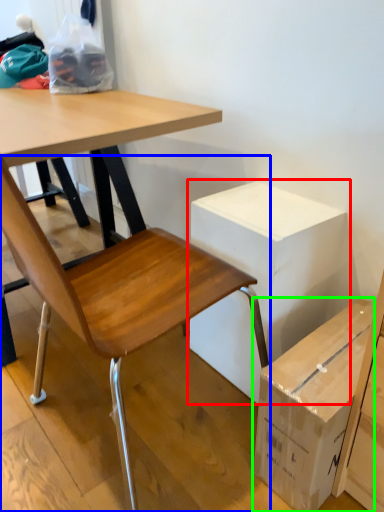
Question: Which is farther away from cardboard box (highlighted by a red box)? chair (highlighted by a blue box) or box (highlighted by a green box)?

Choices:
 (A) chair
 (B) box

Answer: (B)